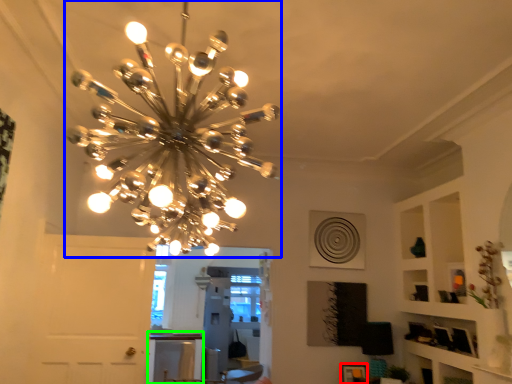
Question: Based on their relative distances, which object is farther from picture frame (highlighted by a red box)? Choose from lamp (highlighted by a blue box) and table (highlighted by a green box).

Choices:
 (A) lamp
 (B) table

Answer: (B)